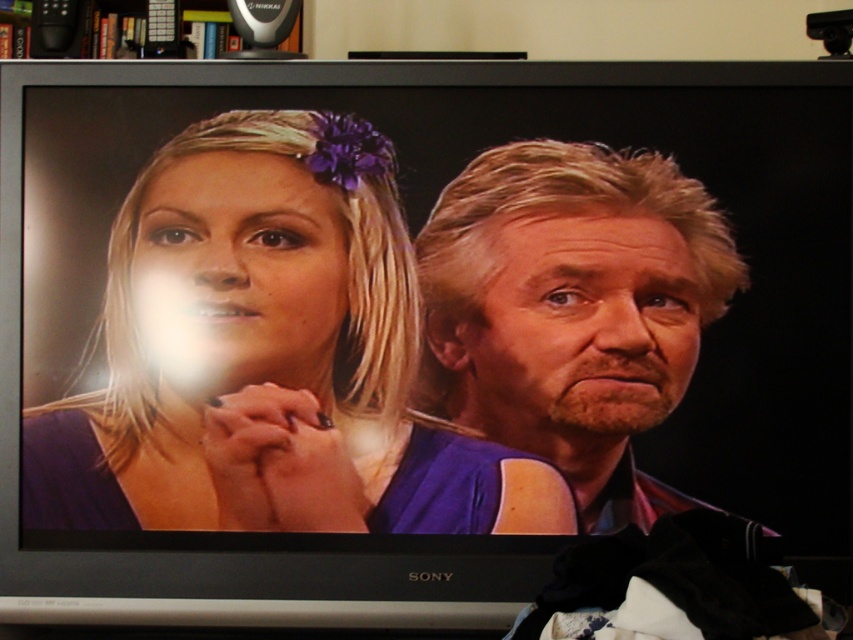
Question: Is purple matte hair clip at center wider than blonde hair at right?

Choices:
 (A) yes
 (B) no

Answer: (A)

Question: Is blonde hair at right closer to camera compared to wooden bookshelf at upper center?

Choices:
 (A) yes
 (B) no

Answer: (A)

Question: Which object appears farthest from the camera in this image?

Choices:
 (A) wooden bookshelf at upper center
 (B) purple matte hair clip at center

Answer: (A)

Question: In this image, where is blonde hair at right located relative to wooden bookshelf at upper center?

Choices:
 (A) above
 (B) below

Answer: (B)

Question: Which of these objects is positioned closest to the purple matte hair clip at center?

Choices:
 (A) wooden bookshelf at upper center
 (B) blonde hair at right

Answer: (B)

Question: Which object is positioned closest to the wooden bookshelf at upper center?

Choices:
 (A) blonde hair at right
 (B) purple matte hair clip at center

Answer: (B)